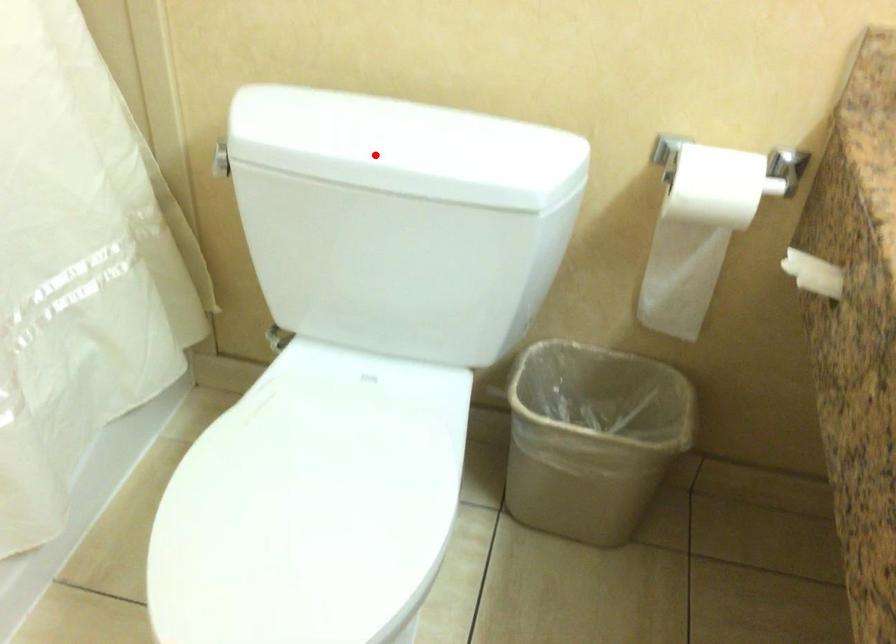
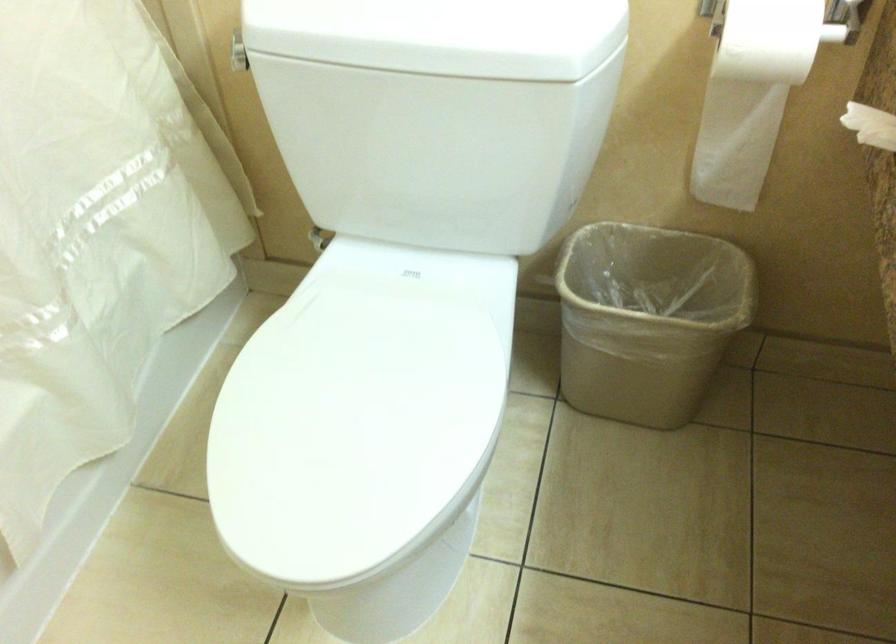
In the second image, find the point that corresponds to the highlighted location in the first image.

(393, 35)